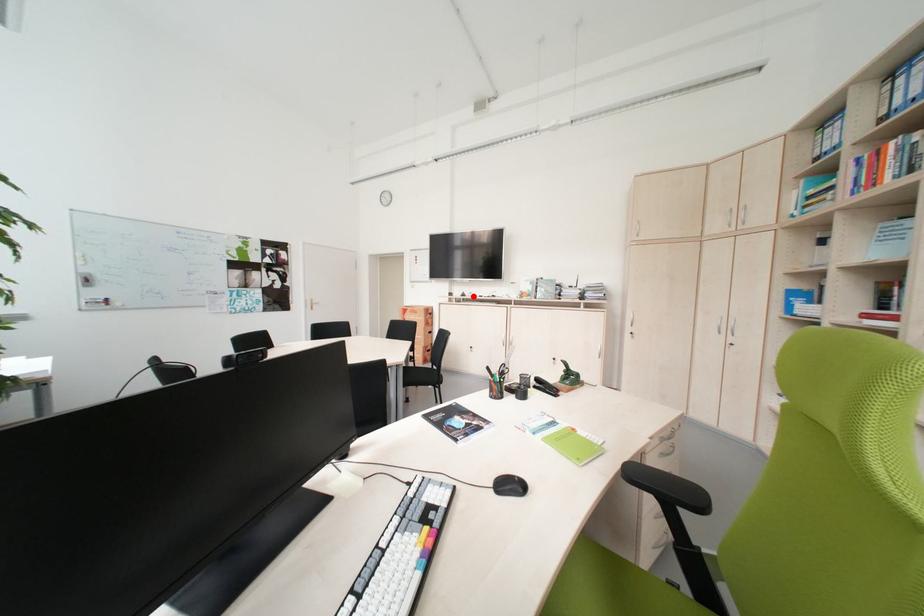
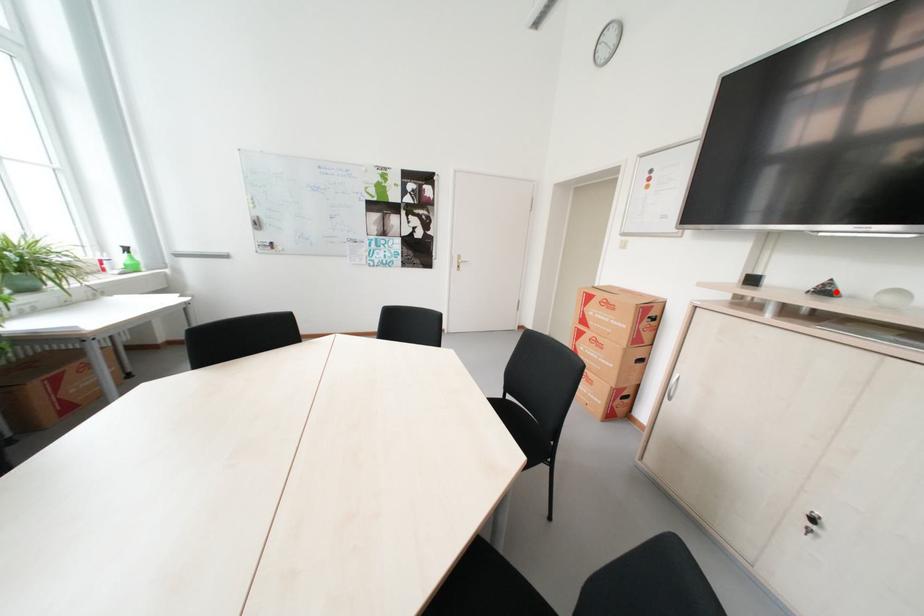
I am providing you with two images of the same scene from different viewpoints. A red point is marked on the first image and another point is marked on the second image. Is the red point in image1 aligned with the point shown in image2?

Yes